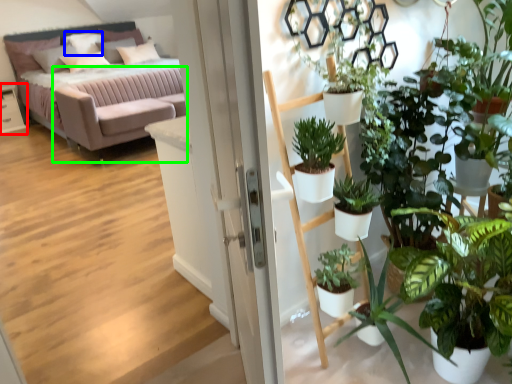
Question: Which object is the farthest from table (highlighted by a red box)? Choose among these: pillow (highlighted by a blue box) or couch (highlighted by a green box).

Choices:
 (A) pillow
 (B) couch

Answer: (B)